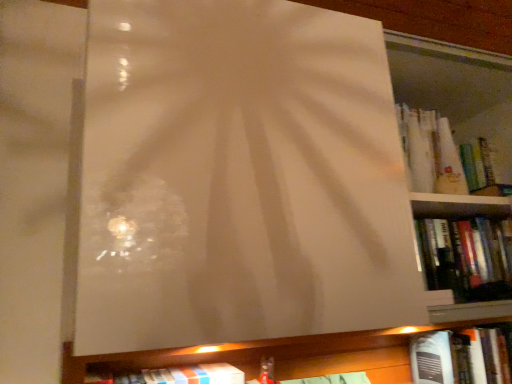
Question: From the image's perspective, is white matte book at lower center, the 3th book from the top, below hardcover book at upper right, acting as the 3th book starting from the left?

Choices:
 (A) no
 (B) yes

Answer: (B)

Question: Can you confirm if white matte book at lower center, the 2th book positioned from the bottom, is thinner than hardcover book at upper right, marked as the 1th book in a top-to-bottom arrangement?

Choices:
 (A) yes
 (B) no

Answer: (B)

Question: Does white matte book at lower center, the 2th book positioned from the bottom, contain hardcover book at upper right, acting as the 3th book starting from the left?

Choices:
 (A) yes
 (B) no

Answer: (B)

Question: Is white matte book at lower center, positioned as the 1th book in left-to-right order, positioned behind hardcover book at upper right, which ranks as the second book in right-to-left order?

Choices:
 (A) no
 (B) yes

Answer: (A)

Question: Can you see white matte book at lower center, placed as the 4th book when sorted from right to left, touching hardcover book at upper right, marked as the 1th book in a top-to-bottom arrangement?

Choices:
 (A) no
 (B) yes

Answer: (A)

Question: Is white matte book at lower center, the 2th book positioned from the bottom, wider than hardcover book at upper right, which ranks as the second book in right-to-left order?

Choices:
 (A) yes
 (B) no

Answer: (A)

Question: Considering the relative sizes of hardcover book at lower right, which is the fourth book in left-to-right order, and white matte book at lower center, the 2th book positioned from the bottom, in the image provided, is hardcover book at lower right, which is the fourth book in left-to-right order, taller than white matte book at lower center, the 2th book positioned from the bottom,?

Choices:
 (A) no
 (B) yes

Answer: (B)

Question: Is hardcover book at lower right, acting as the 1th book starting from the right, facing away from white matte book at lower center, positioned as the 1th book in left-to-right order?

Choices:
 (A) yes
 (B) no

Answer: (B)

Question: From the image's perspective, is hardcover book at lower right, acting as the fourth book starting from the top, over white matte book at lower center, the 3th book from the top?

Choices:
 (A) yes
 (B) no

Answer: (B)

Question: Does hardcover book at lower right, which is the fourth book in left-to-right order, lie behind white matte book at lower center, the 2th book positioned from the bottom?

Choices:
 (A) no
 (B) yes

Answer: (B)

Question: From the image's perspective, is hardcover book at lower right, acting as the fourth book starting from the top, under white matte book at lower center, positioned as the 1th book in left-to-right order?

Choices:
 (A) yes
 (B) no

Answer: (A)

Question: Is hardcover book at lower right, acting as the fourth book starting from the top, located outside white matte book at lower center, the 3th book from the top?

Choices:
 (A) no
 (B) yes

Answer: (B)

Question: Does hardcover book at upper right, which appears as the second book when viewed from the top, have a smaller size compared to hardcover book at upper right, which ranks as the second book in right-to-left order?

Choices:
 (A) no
 (B) yes

Answer: (A)